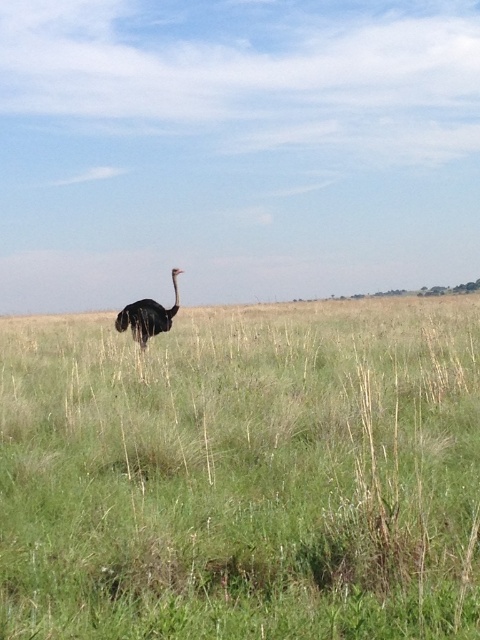
Question: Is green grass at center smaller than dark brown feathers at center?

Choices:
 (A) no
 (B) yes

Answer: (A)

Question: Which point appears farthest from the camera in this image?

Choices:
 (A) (142, 298)
 (B) (175, 380)

Answer: (A)

Question: Among these objects, which one is nearest to the camera?

Choices:
 (A) green grass at center
 (B) dark brown feathers at center

Answer: (A)

Question: Can you confirm if green grass at center is positioned above dark brown feathers at center?

Choices:
 (A) yes
 (B) no

Answer: (B)

Question: Considering the relative positions of green grass at center and dark brown feathers at center in the image provided, where is green grass at center located with respect to dark brown feathers at center?

Choices:
 (A) right
 (B) left

Answer: (A)